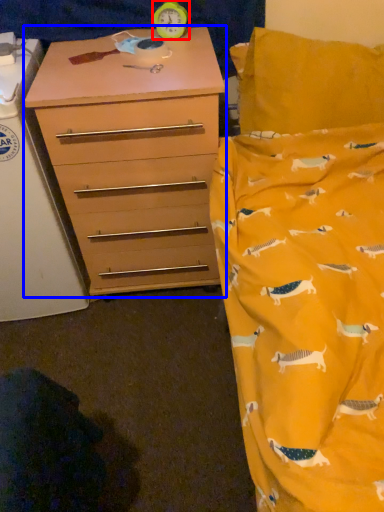
Question: Which object is closer to the camera taking this photo, clock (highlighted by a red box) or chest of drawers (highlighted by a blue box)?

Choices:
 (A) clock
 (B) chest of drawers

Answer: (B)